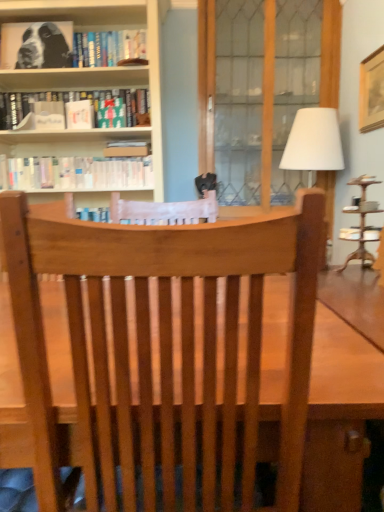
Where is `free spot above black and white print at upper left, acting as the third book starting from the bottom (from a real-world perspective)`? The image size is (384, 512). free spot above black and white print at upper left, acting as the third book starting from the bottom (from a real-world perspective) is located at coordinates (77, 22).